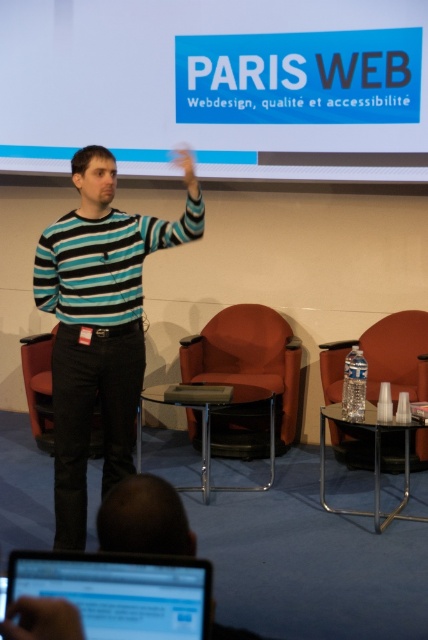
Question: Which object is farther from the camera taking this photo?

Choices:
 (A) orange fabric armchair at right
 (B) velvet orange armchair at center

Answer: (A)

Question: Does blue plastic projection screen at upper center appear on the left side of velvet orange armchair at center?

Choices:
 (A) yes
 (B) no

Answer: (A)

Question: Which object appears closest to the camera in this image?

Choices:
 (A) matte black hand at lower left
 (B) velvet orange armchair at center
 (C) matte black laptop at lower left
 (D) matte black hand at upper center

Answer: (A)

Question: Which object appears farthest from the camera in this image?

Choices:
 (A) velvet orange armchair at center
 (B) matte black hand at lower left
 (C) black fabric armchair at center
 (D) orange fabric armchair at right

Answer: (C)

Question: Can you confirm if striped cotton shirt at center is wider than orange fabric armchair at right?

Choices:
 (A) no
 (B) yes

Answer: (B)

Question: Can you confirm if striped cotton shirt at center is positioned to the right of velvet orange armchair at center?

Choices:
 (A) yes
 (B) no

Answer: (B)